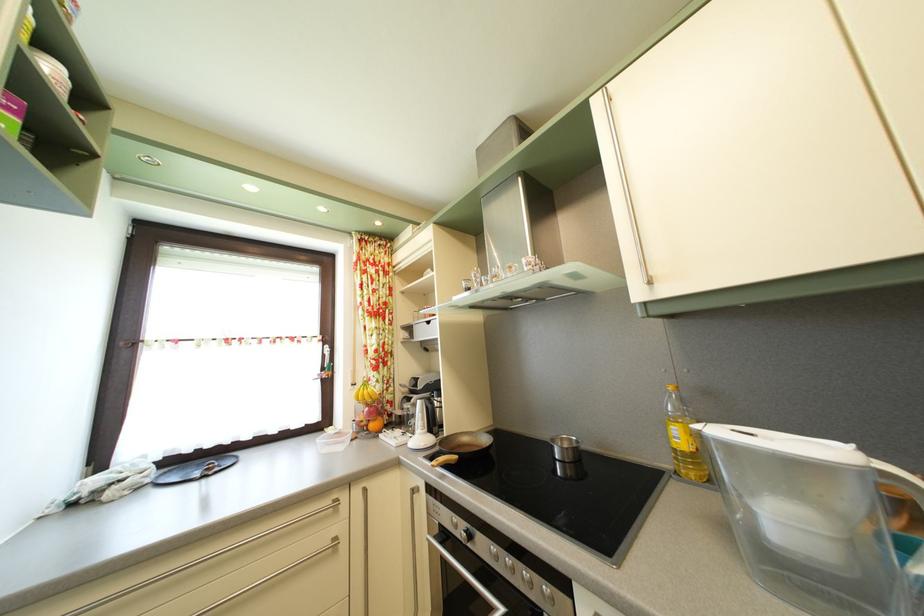
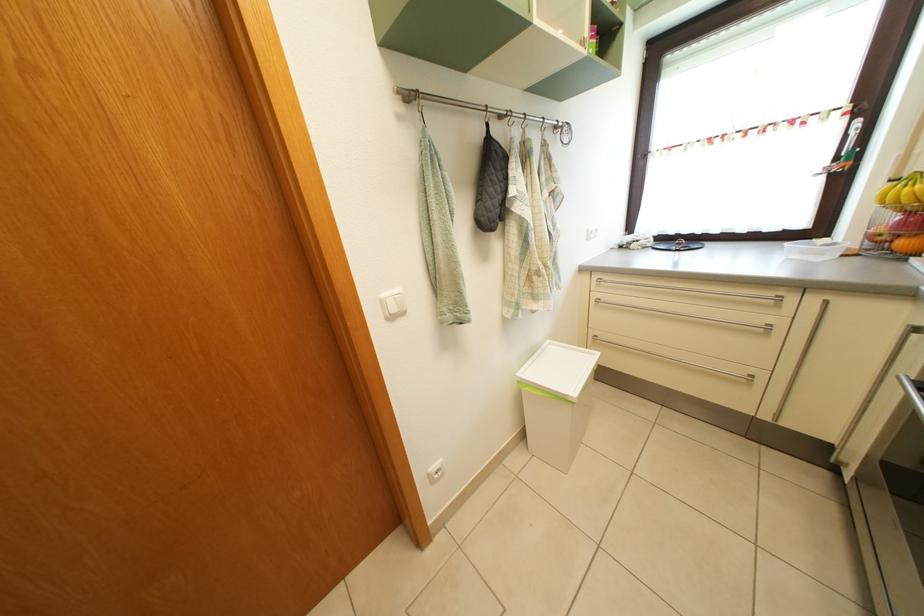
Where in the second image is the point corresponding to (381,432) from the first image?

(910, 252)